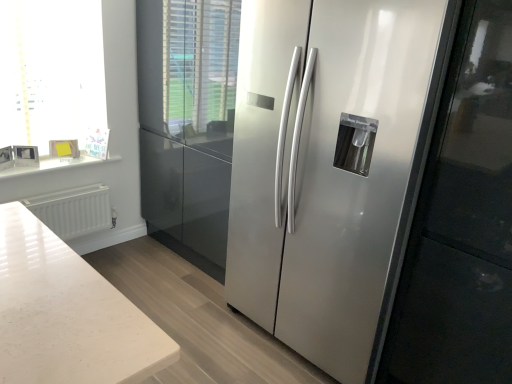
Question: Should I look upward or downward to see white glossy frame at upper left?

Choices:
 (A) down
 (B) up

Answer: (B)

Question: Can you confirm if white marble counter top at upper left is positioned to the right of satin silver refrigerator at center?

Choices:
 (A) no
 (B) yes

Answer: (A)

Question: Is the position of white marble counter top at upper left more distant than that of satin silver refrigerator at center?

Choices:
 (A) yes
 (B) no

Answer: (A)

Question: Is satin silver refrigerator at center inside white marble counter top at upper left?

Choices:
 (A) no
 (B) yes

Answer: (A)

Question: Is white marble counter top at upper left next to satin silver refrigerator at center and touching it?

Choices:
 (A) no
 (B) yes

Answer: (A)

Question: Is the depth of white marble counter top at upper left less than that of satin silver refrigerator at center?

Choices:
 (A) no
 (B) yes

Answer: (A)

Question: Is white marble counter top at upper left aimed at satin silver refrigerator at center?

Choices:
 (A) no
 (B) yes

Answer: (A)

Question: From a real-world perspective, is white glossy frame at upper left located higher than white matte radiator at lower left?

Choices:
 (A) no
 (B) yes

Answer: (B)

Question: Is white glossy frame at upper left facing away from white matte radiator at lower left?

Choices:
 (A) yes
 (B) no

Answer: (B)

Question: Is white glossy frame at upper left to the right of white matte radiator at lower left from the viewer's perspective?

Choices:
 (A) yes
 (B) no

Answer: (B)

Question: Considering the relative sizes of white glossy frame at upper left and white matte radiator at lower left in the image provided, is white glossy frame at upper left wider than white matte radiator at lower left?

Choices:
 (A) yes
 (B) no

Answer: (A)

Question: Would you say white glossy frame at upper left is a long distance from white matte radiator at lower left?

Choices:
 (A) yes
 (B) no

Answer: (B)

Question: Are white glossy frame at upper left and white matte radiator at lower left beside each other?

Choices:
 (A) yes
 (B) no

Answer: (B)

Question: Is satin silver refrigerator at center surrounding white matte radiator at lower left?

Choices:
 (A) no
 (B) yes

Answer: (A)